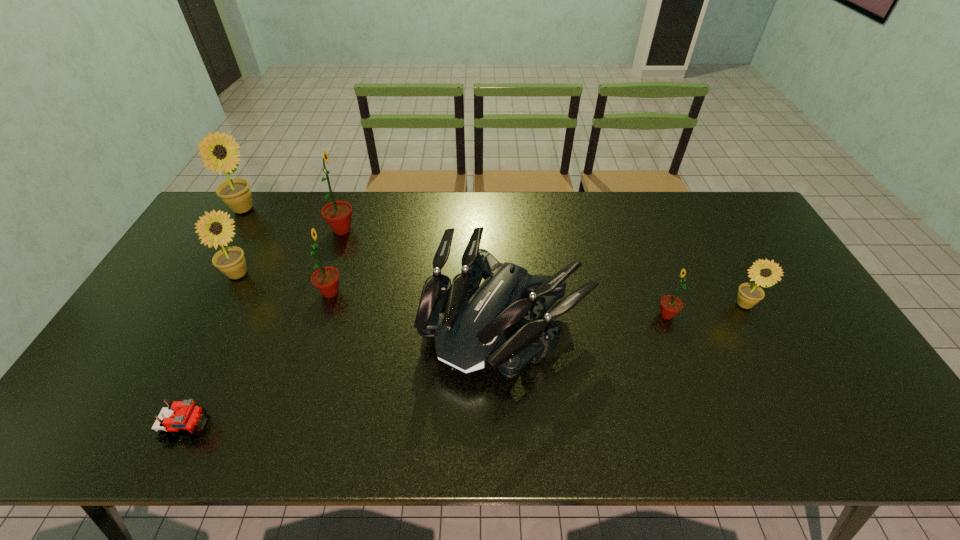
At what (x,y) coordinates should I click in order to perform the action: click on vacant space located 0.250m on the face of the smallest yellow sunflower. Please return your answer as a coordinate pair (x, y). The image size is (960, 540). Looking at the image, I should click on point(792,395).

Find the location of a particular element. The image size is (960, 540). vacant space located on the left of the third object from right to left is located at coordinates (393, 321).

Find the location of `free region located 0.150m on the front-facing side of the Lego`. free region located 0.150m on the front-facing side of the Lego is located at coordinates (274, 428).

At what (x,y) coordinates should I click in order to perform the action: click on object that is at the near edge. Please return your answer as a coordinate pair (x, y). Looking at the image, I should click on click(184, 416).

The width and height of the screenshot is (960, 540). Identify the location of object that is at the left edge. (235, 193).

You are a GUI agent. You are given a task and a screenshot of the screen. Output one action in this format:
    pyautogui.click(x=<x>, y=<y>)
    Task: Click on the object at the right edge
    
    Given the screenshot: What is the action you would take?
    pyautogui.click(x=749, y=294)

You are a GUI agent. You are given a task and a screenshot of the screen. Output one action in this format:
    pyautogui.click(x=<x>, y=<y>)
    Task: Click on the object that is at the far left corner
    The image size is (960, 540).
    Given the screenshot: What is the action you would take?
    pyautogui.click(x=235, y=193)

The height and width of the screenshot is (540, 960). Identify the location of vacant space at the far edge of the desktop. 696,201.

Find the location of `vacant space at the near edge of the desktop`. vacant space at the near edge of the desktop is located at coordinates (716, 448).

In the image, there is a desktop. Identify the location of vacant space at the left edge. The image size is (960, 540). (189, 252).